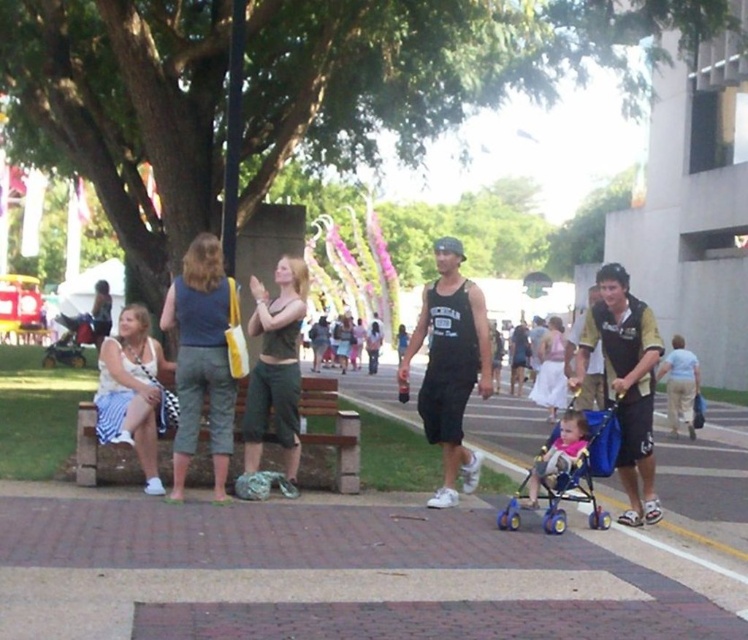
Does orange plastic baby carriage at lower right come in front of pink fabric stroller at lower right?

Yes, it is in front of pink fabric stroller at lower right.

The image size is (748, 640). Find the location of `orange plastic baby carriage at lower right`. orange plastic baby carriage at lower right is located at coordinates (568, 468).

Is point (562, 580) more distant than point (473, 477)?

No, it is in front of (473, 477).

Is brick pavement at lower center shorter than black tank top at center?

Yes.

Does point (557, 582) come behind point (462, 388)?

No, it is not.

In order to click on brick pavement at lower center in this screenshot , I will do `click(340, 572)`.

Which is behind, point (438, 305) or point (503, 520)?

The point (438, 305) is more distant.

Is black tank top at center positioned behind orange plastic baby carriage at lower right?

That is True.

Between point (484, 355) and point (539, 467), which one is positioned in front?

Point (539, 467)

Find the location of a particular element. black tank top at center is located at coordinates (450, 365).